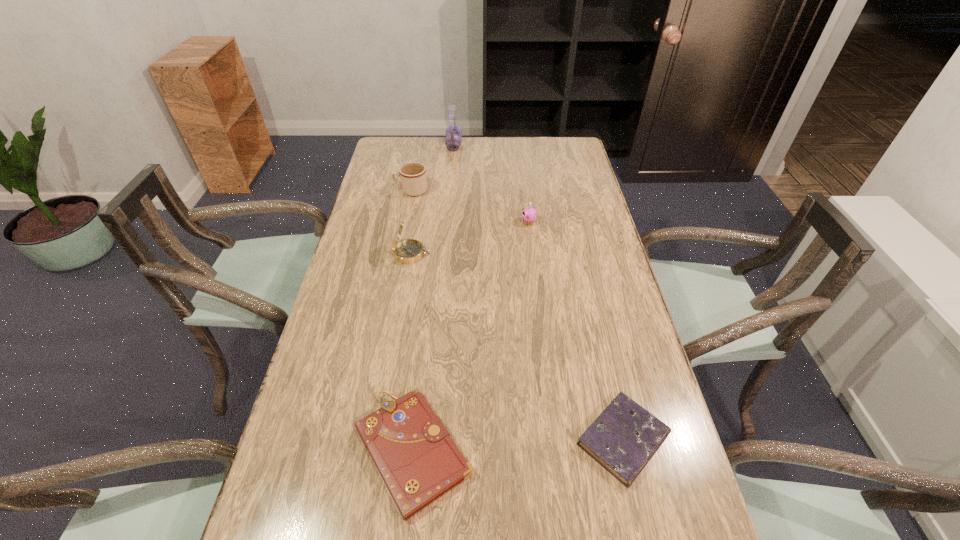
The width and height of the screenshot is (960, 540). In order to click on object that is at the far edge in this screenshot , I will do `click(453, 132)`.

In order to click on compass that is at the left edge in this screenshot , I will do `click(408, 251)`.

Where is `mug that is at the left edge`? This screenshot has width=960, height=540. mug that is at the left edge is located at coordinates (413, 178).

Identify the location of notebook that is at the left edge. (418, 461).

Locate an element on the screen. This screenshot has height=540, width=960. object at the right edge is located at coordinates (623, 438).

The height and width of the screenshot is (540, 960). In the image, there is a desktop. What are the coordinates of `free region at the far edge` in the screenshot? It's located at (492, 161).

The width and height of the screenshot is (960, 540). In the image, there is a desktop. In order to click on vacant space at the left edge in this screenshot , I will do `click(350, 490)`.

Where is `free point at the right edge`? This screenshot has width=960, height=540. free point at the right edge is located at coordinates (636, 537).

The image size is (960, 540). In order to click on vacant region at the far left corner in this screenshot , I will do `click(417, 156)`.

The image size is (960, 540). In order to click on free spot at the far right corner of the desktop in this screenshot , I will do `click(579, 165)`.